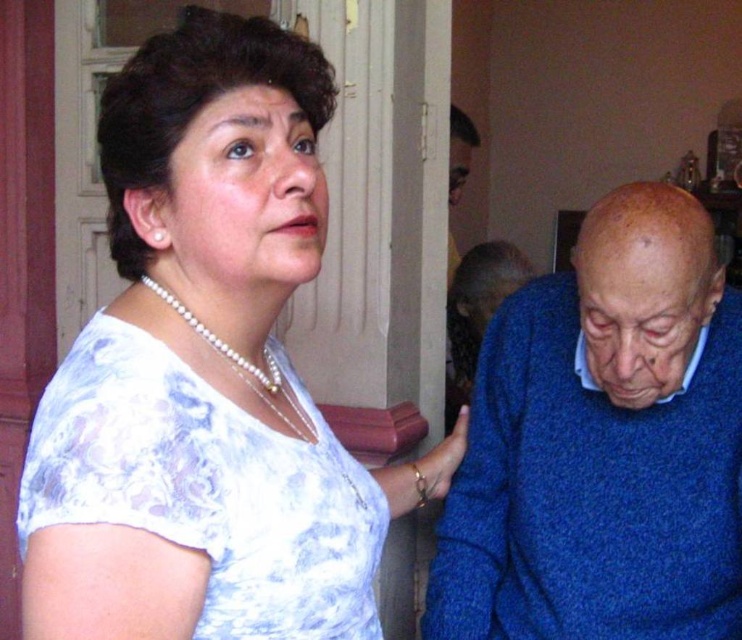
Question: Can you confirm if white lace blouse at upper left is thinner than pearl necklace at upper left?

Choices:
 (A) no
 (B) yes

Answer: (A)

Question: Can you confirm if white lace blouse at upper left is positioned to the right of blue knitted sweater at right?

Choices:
 (A) yes
 (B) no

Answer: (B)

Question: Is the position of white lace blouse at upper left less distant than that of pearl necklace at upper left?

Choices:
 (A) yes
 (B) no

Answer: (A)

Question: Considering the real-world distances, which object is closest to the pearl necklace at upper left?

Choices:
 (A) white lace blouse at upper left
 (B) blue knitted sweater at right

Answer: (A)

Question: Which object is the closest to the white lace blouse at upper left?

Choices:
 (A) blue knitted sweater at right
 (B) pearl necklace at upper left

Answer: (B)

Question: Which object is farther from the camera taking this photo?

Choices:
 (A) pearl necklace at upper left
 (B) blue knitted sweater at right

Answer: (B)